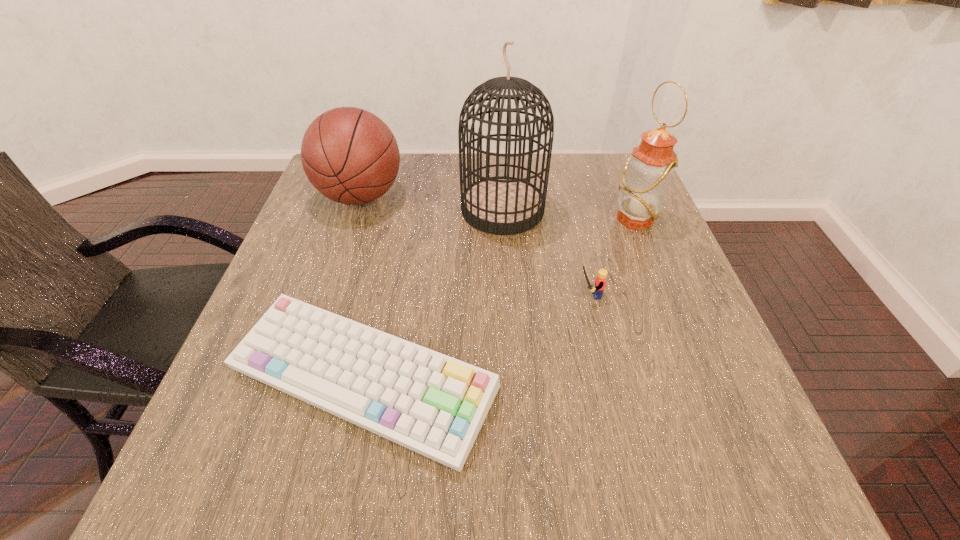
At what (x,y) coordinates should I click in order to perform the action: click on vacant area situated 0.090m on the back of the basketball. Please return your answer as a coordinate pair (x, y). This screenshot has height=540, width=960. Looking at the image, I should click on (373, 157).

Find the location of a particular element. The height and width of the screenshot is (540, 960). vacant area situated 0.300m on the front-facing side of the second shortest object is located at coordinates (430, 295).

This screenshot has width=960, height=540. In order to click on vacant space positioned 0.140m on the front-facing side of the second shortest object in this screenshot , I will do `click(507, 295)`.

Locate an element on the screen. vacant position located on the front-facing side of the second shortest object is located at coordinates (387, 295).

Identify the location of vacant space located on the back of the computer keyboard. (382, 290).

This screenshot has width=960, height=540. Identify the location of birdcage that is at the far edge. (501, 205).

Where is `basketball situated at the far edge`? The height and width of the screenshot is (540, 960). basketball situated at the far edge is located at coordinates (349, 155).

Locate an element on the screen. The image size is (960, 540). object at the near edge is located at coordinates (433, 404).

Where is `basketball that is at the left edge`? The width and height of the screenshot is (960, 540). basketball that is at the left edge is located at coordinates (349, 155).

Identify the location of computer keyboard present at the left edge. The height and width of the screenshot is (540, 960). (433, 404).